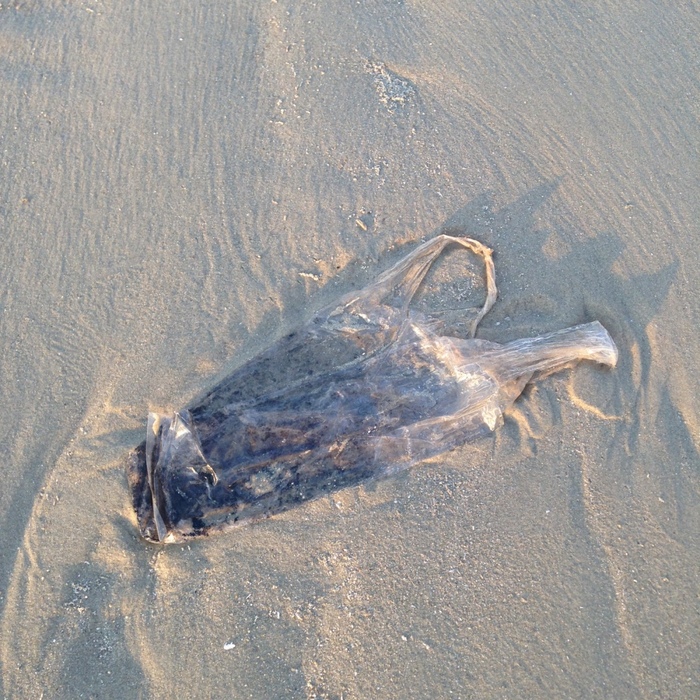
Where is `trash`? Image resolution: width=700 pixels, height=700 pixels. trash is located at coordinates (189, 507).